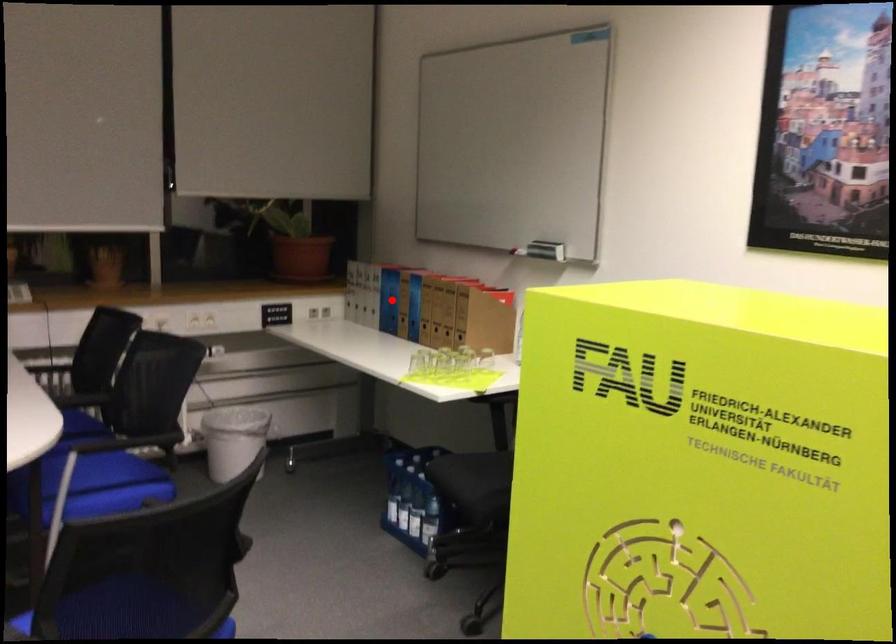
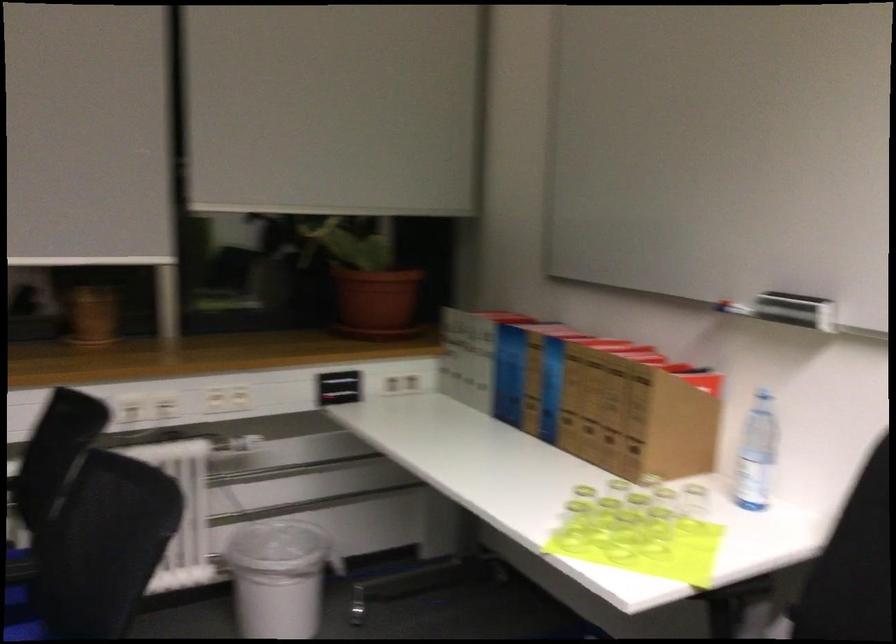
Question: I am providing you with two images of the same scene from different viewpoints. A red point is marked on the first image. Can you still see the location of the red point in image 2?

Choices:
 (A) Yes
 (B) No

Answer: (A)